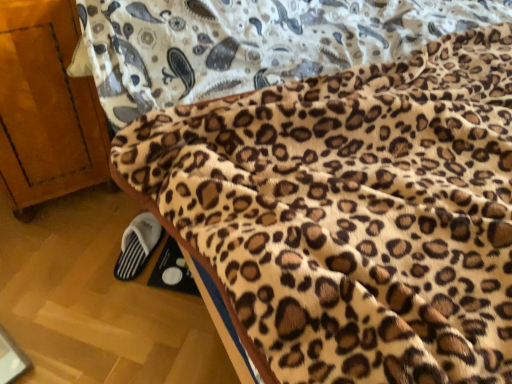
You are a GUI agent. You are given a task and a screenshot of the screen. Output one action in this format:
    pyautogui.click(x=<x>, y=<y>)
    Task: Click on the empty space that is in between wooden cabinet at left and white fabric slipper at lower left
    
    Given the screenshot: What is the action you would take?
    pyautogui.click(x=89, y=238)